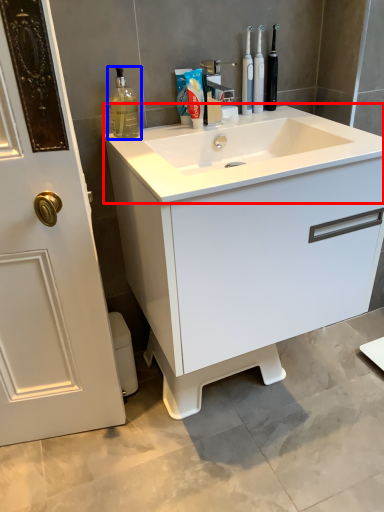
Question: Which point is closer to the camera, counter top (highlighted by a red box) or cleaning product (highlighted by a blue box)?

Choices:
 (A) counter top
 (B) cleaning product

Answer: (A)